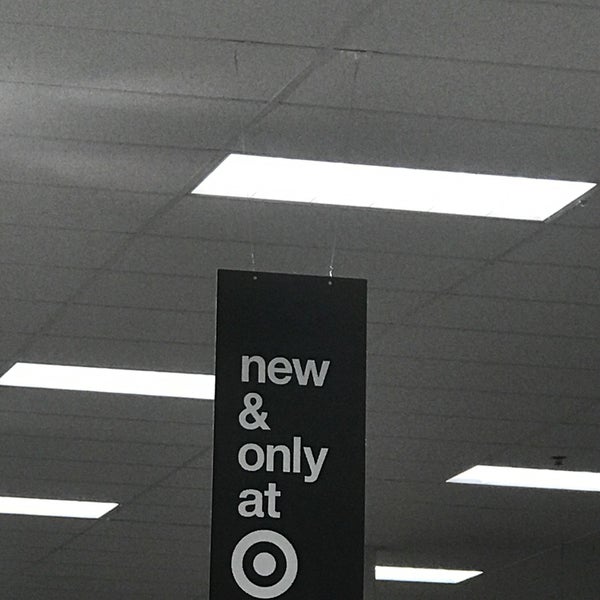
Identify the location of lights ceiling. (58, 515), (124, 384), (372, 197), (557, 469), (420, 592).